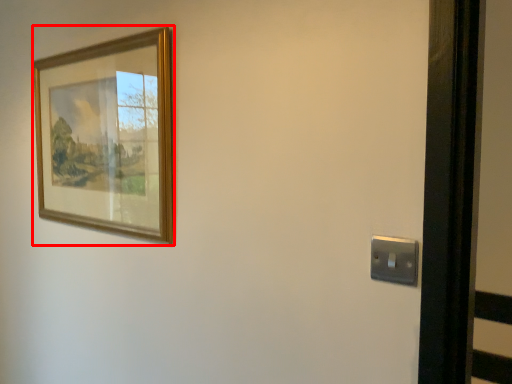
Question: From the image's perspective, what is the correct spatial positioning of picture frame (annotated by the red box) in reference to light switch?

Choices:
 (A) above
 (B) below

Answer: (A)